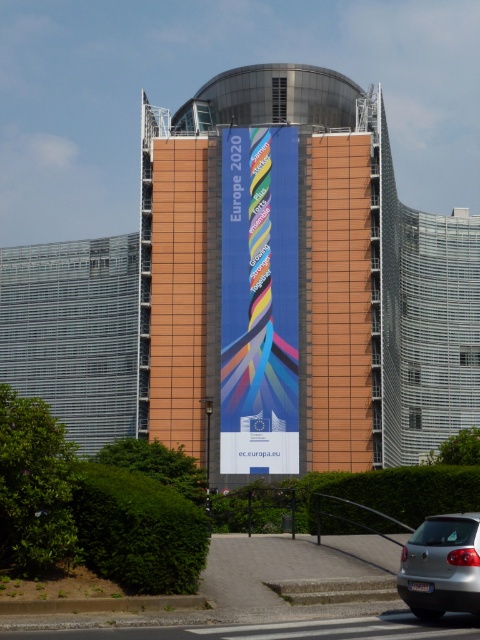
From the picture: Does blue fabric banner at center have a greater width compared to satin silver sedan at lower right?

Yes.

Is blue fabric banner at center taller than satin silver sedan at lower right?

Yes.

Who is more forward, (269,243) or (417,554)?

Point (417,554) is more forward.

You are a GUI agent. You are given a task and a screenshot of the screen. Output one action in this format:
    pyautogui.click(x=<x>, y=<y>)
    Task: Click on the blue fabric banner at center
    
    Given the screenshot: What is the action you would take?
    pyautogui.click(x=259, y=301)